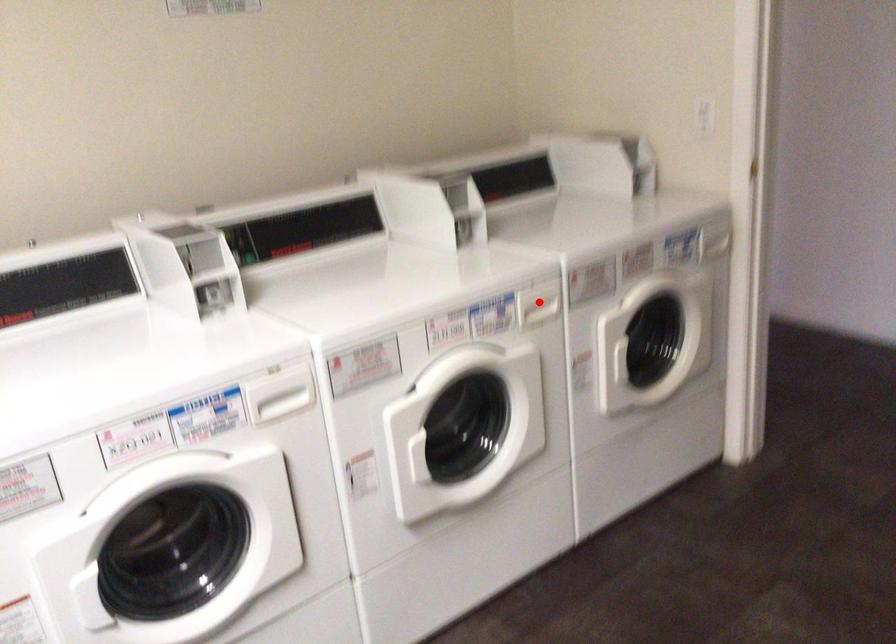
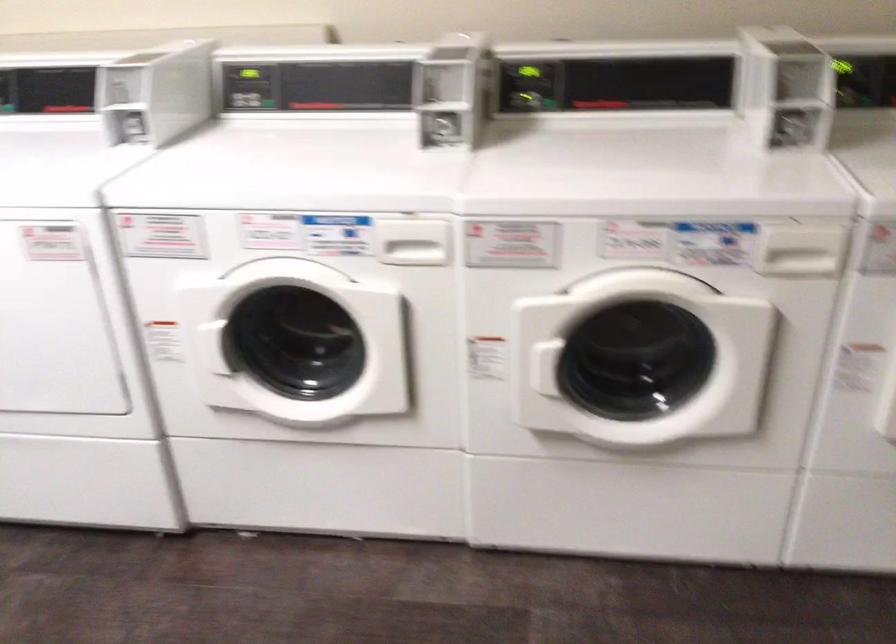
In the second image, find the point that corresponds to the highlighted location in the first image.

(800, 251)